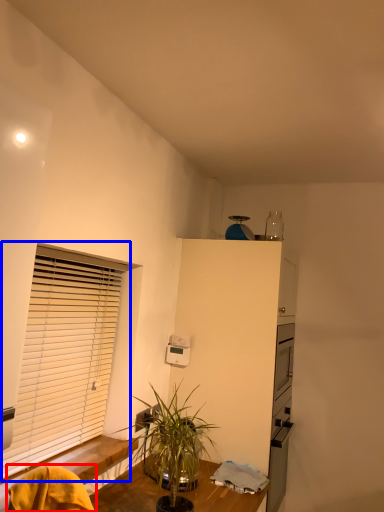
Question: Which object appears closest to the camera in this image, swivel chair (highlighted by a red box) or window blind (highlighted by a blue box)?

Choices:
 (A) swivel chair
 (B) window blind

Answer: (A)